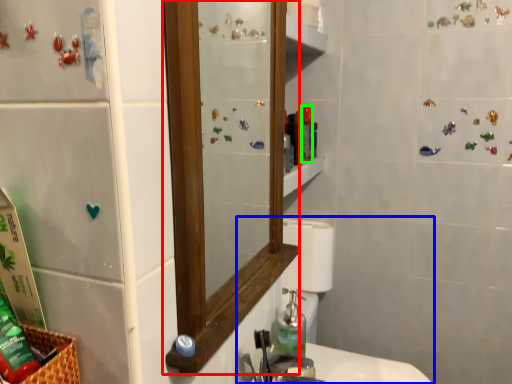
Question: Which object is positioned closest to mirror (highlighted by a red box)? Select from sink (highlighted by a blue box) and toiletry (highlighted by a green box).

Choices:
 (A) sink
 (B) toiletry

Answer: (B)